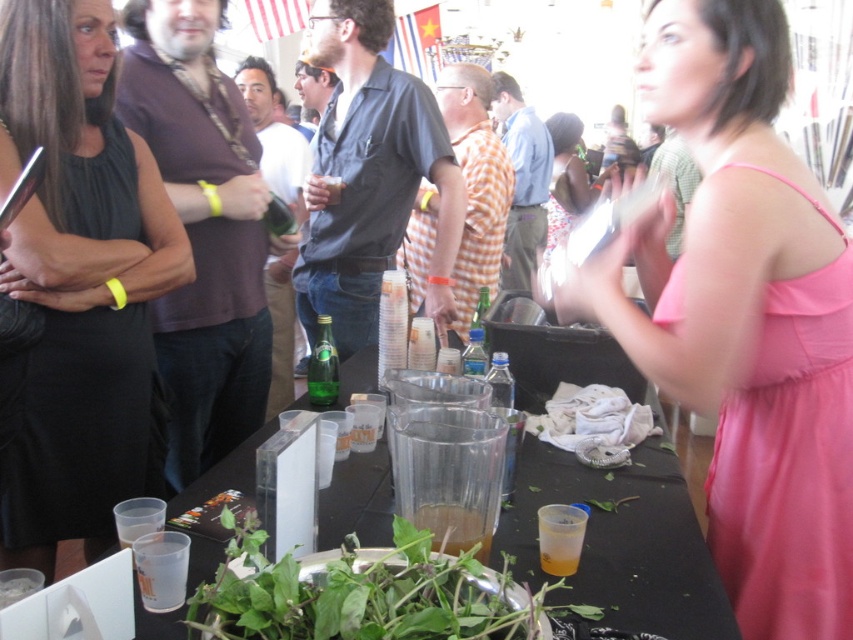
Question: Does black sleeveless dress at left have a greater width compared to translucent plastic cup at center?

Choices:
 (A) no
 (B) yes

Answer: (B)

Question: Which point is farther from the camera taking this photo?

Choices:
 (A) (726, 452)
 (B) (546, 531)

Answer: (A)

Question: Which object appears farthest from the camera in this image?

Choices:
 (A) green leafy vegetable at center
 (B) clear plastic cups at center
 (C) pink satin dress at center
 (D) green glass bottle at center

Answer: (C)

Question: Which of these objects is positioned farthest from the green leafy vegetable at center?

Choices:
 (A) pink satin dress at center
 (B) green glass bottle at center
 (C) translucent plastic cup at lower center

Answer: (A)

Question: In this image, where is clear plastic cups at center located relative to pink satin dress at center?

Choices:
 (A) left
 (B) right

Answer: (A)

Question: Observing the image, what is the correct spatial positioning of pink satin dress at right in reference to black sleeveless dress at left?

Choices:
 (A) right
 (B) left

Answer: (A)